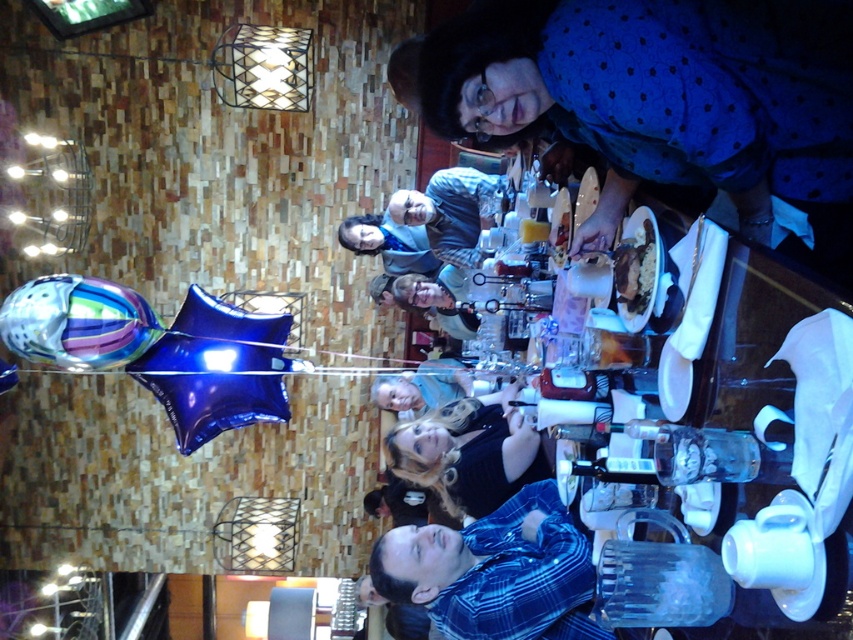
The width and height of the screenshot is (853, 640). What are the coordinates of `multicolored glossy balloon at lower left` in the screenshot? It's located at (77, 323).

Can you confirm if multicolored glossy balloon at lower left is taller than translucent glass cup at center?

Yes, multicolored glossy balloon at lower left is taller than translucent glass cup at center.

Does point (91, 330) lie in front of point (532, 227)?

No, it is behind (532, 227).

You are a GUI agent. You are given a task and a screenshot of the screen. Output one action in this format:
    pyautogui.click(x=<x>, y=<y>)
    Task: Click on the multicolored glossy balloon at lower left
    This screenshot has height=640, width=853.
    Given the screenshot: What is the action you would take?
    pyautogui.click(x=77, y=323)

Does metallic blue star at center have a greater height compared to blue plaid shirt at center?

Yes, metallic blue star at center is taller than blue plaid shirt at center.

Measure the distance between point (175, 374) and camera.

A distance of 6.63 meters exists between point (175, 374) and camera.

Who is more distant from viewer, (189, 340) or (457, 257)?

The point (457, 257) is behind.

Find the location of a particular element. The image size is (853, 640). metallic blue star at center is located at coordinates (218, 369).

Who is positioned more to the right, blue plaid shirt at lower center or multicolored glossy balloon at lower left?

From the viewer's perspective, blue plaid shirt at lower center appears more on the right side.

Which is in front, point (399, 545) or point (90, 284)?

Point (399, 545) is more forward.

This screenshot has height=640, width=853. Identify the location of blue plaid shirt at lower center. [495, 572].

You are a GUI agent. You are given a task and a screenshot of the screen. Output one action in this format:
    pyautogui.click(x=<x>, y=<y>)
    Task: Click on the blue plaid shirt at lower center
    The height and width of the screenshot is (640, 853).
    Given the screenshot: What is the action you would take?
    pyautogui.click(x=495, y=572)